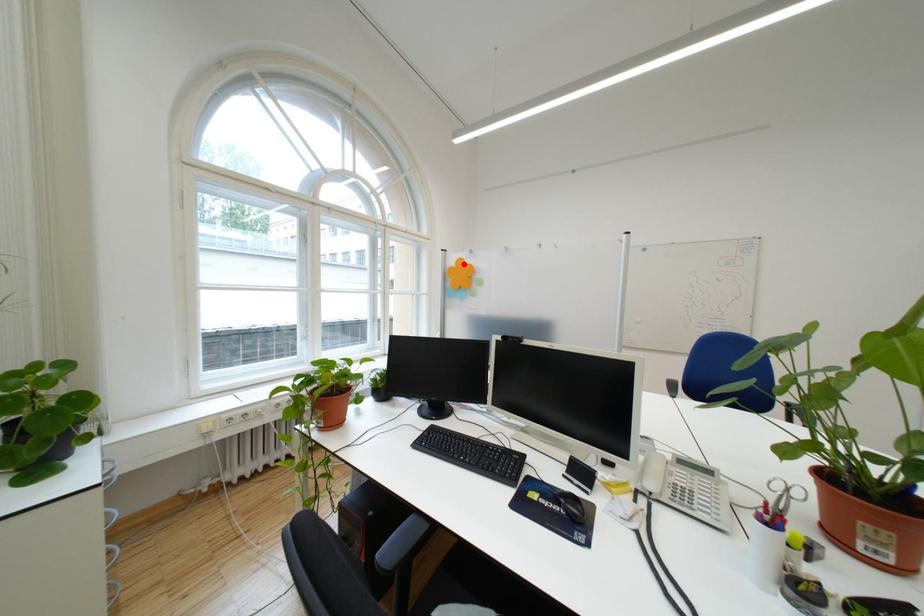
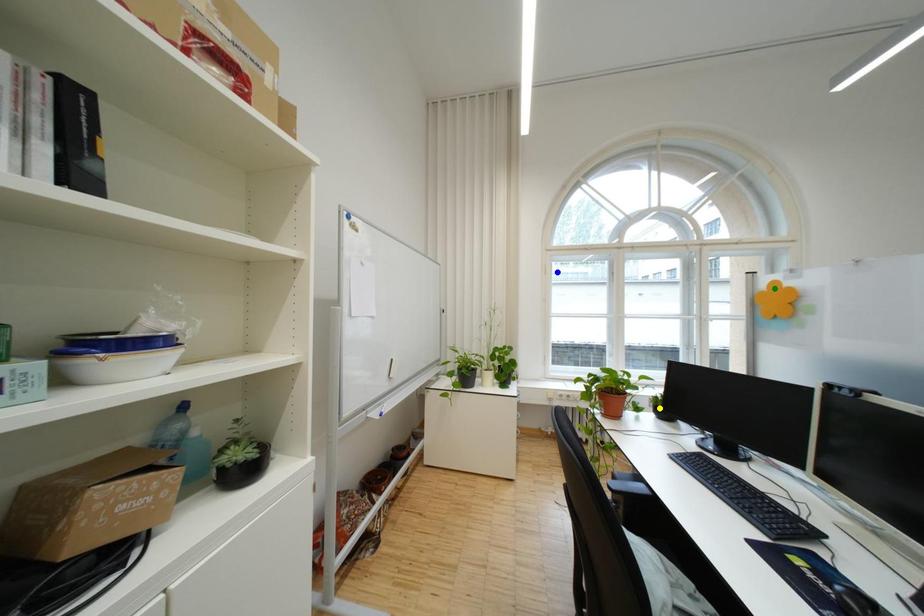
Question: I am providing you with two images of the same scene from different viewpoints. A red point is marked on the first image. You are given multiple points on the second image. Which point in image 2 represents the same 3d spot as the red point in image 1?

Choices:
 (A) green point
 (B) yellow point
 (C) blue point

Answer: (A)